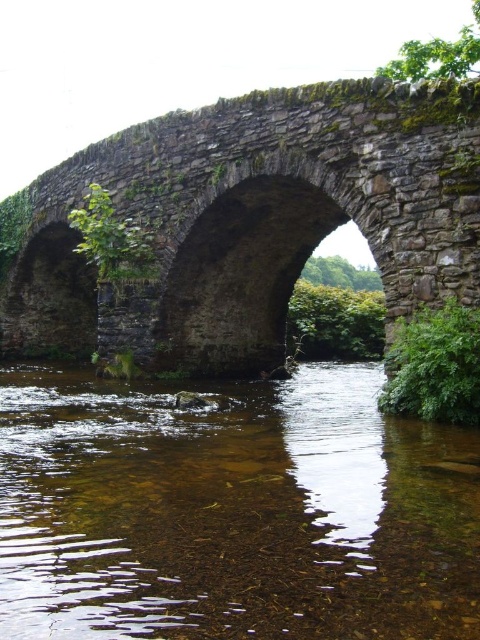
You are standing on a path near the river and want to cross to the other side. The rusty stone bridge at center is partially collapsed, but you notice the clear water at center. Which path should you choose to safely cross the river?

You should choose the clear water at center because it is closer to the viewer than the rusty stone bridge at center, indicating it is more accessible and safer for crossing.

You are standing at the point labeled as point (286,547) on the old stone bridge. A friend is standing 24.64 meters away from you in the direction facing the flowing river. Can you see your friend clearly from your current position?

The distance between you and your friend at point (286,547) is 24.64 meters. Since there are no obstructions mentioned in the scene description, you should be able to see your friend clearly from your current position on the old stone bridge.

You are standing on the bank of the river and want to cross to the other side. The rusty stone bridge at center is partially collapsed. Can you safely walk across the clear water at center instead?

The clear water at center has a lesser height compared to the rusty stone bridge at center, so the water is shallower. However, the safety of walking across depends on the actual depth and stability of the riverbed, which isn not specified in the scene description.